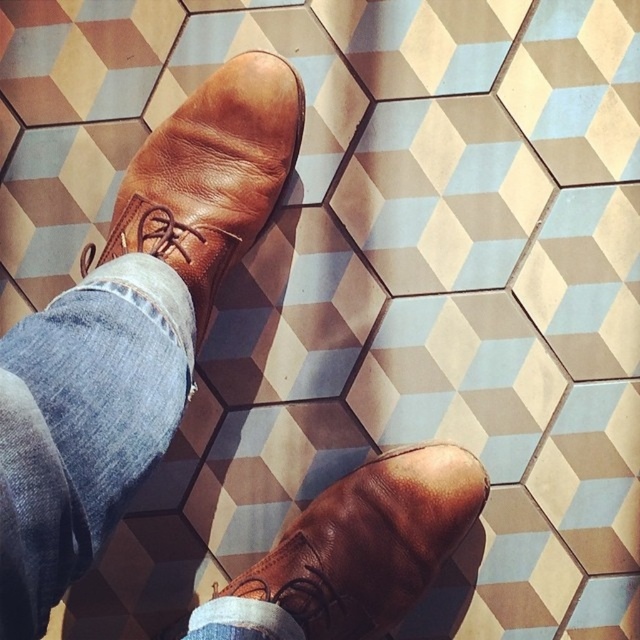
Can you confirm if light blue textured tile at center is bigger than brown leather shoe at upper left?

Actually, light blue textured tile at center might be smaller than brown leather shoe at upper left.

Is light blue textured tile at center shorter than brown leather shoe at upper left?

Indeed, light blue textured tile at center has a lesser height compared to brown leather shoe at upper left.

Identify the location of light blue textured tile at center. (440, 195).

Can you confirm if light blue textured tile at center is bigger than brown leather shoe at lower right?

Incorrect, light blue textured tile at center is not larger than brown leather shoe at lower right.

Does light blue textured tile at center appear on the right side of brown leather shoe at lower right?

Correct, you'll find light blue textured tile at center to the right of brown leather shoe at lower right.

Does point (444, 100) lie in front of point (280, 600)?

No.

You are a GUI agent. You are given a task and a screenshot of the screen. Output one action in this format:
    pyautogui.click(x=<x>, y=<y>)
    Task: Click on the light blue textured tile at center
    Image resolution: width=640 pixels, height=640 pixels.
    Given the screenshot: What is the action you would take?
    pyautogui.click(x=440, y=195)

Who is positioned more to the left, brown leather shoe at upper left or brown leather shoe at lower right?

brown leather shoe at upper left

Can you confirm if brown leather shoe at upper left is thinner than brown leather shoe at lower right?

Yes.

The height and width of the screenshot is (640, 640). Find the location of `brown leather shoe at upper left`. brown leather shoe at upper left is located at coordinates (211, 176).